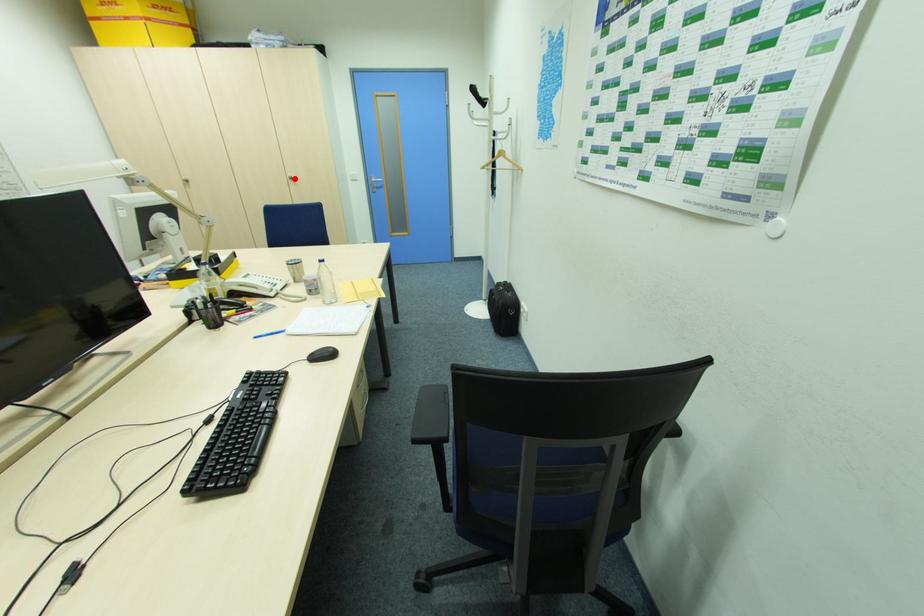
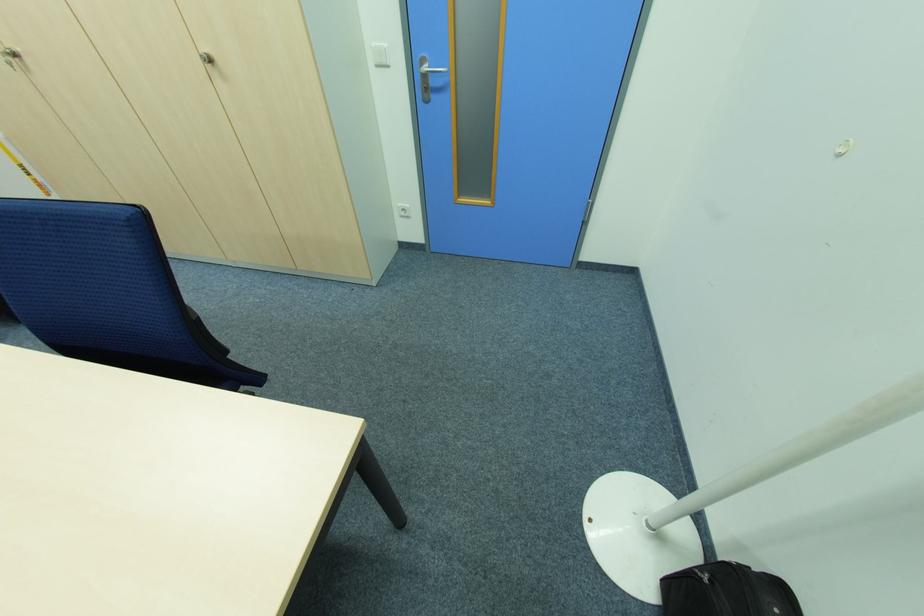
Locate, in the second image, the point that corresponds to the highlighted location in the first image.

(213, 62)